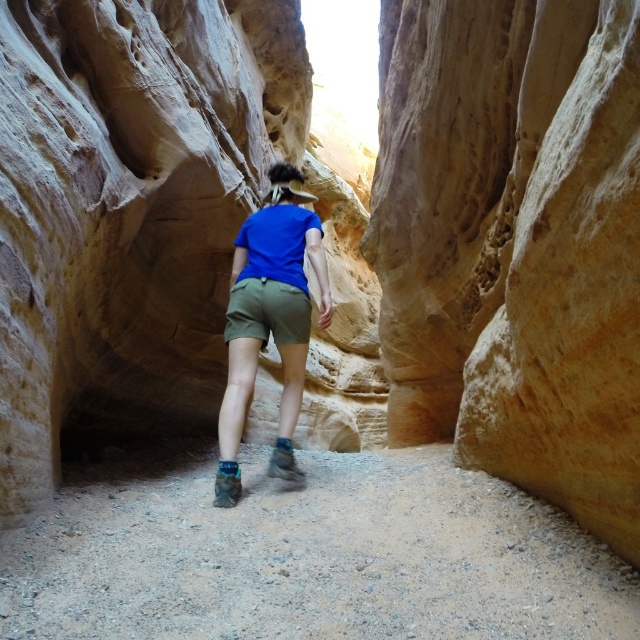
You are a photographer planning to take a portrait of the person in the narrow slot canyon. Since the canyon walls are very close, you need to ensure the person is framed properly. Given the positions of the blue fabric shirt at center and the khaki cotton shorts at center, which clothing item should be positioned closer to the camera to avoid the canyon walls blocking the view?

The blue fabric shirt at center is not as tall as the khaki cotton shorts at center, so positioning the blue fabric shirt at center closer to the camera would help avoid the taller khaki cotton shorts at center being obscured by the canyon walls.

You are a photographer planning to take a portrait of the person in the canyon. Given that the blue fabric shirt at center is below the khaki cotton shorts at center, where should you position your camera to ensure both items are visible in the frame?

Position the camera at a lower angle so that the blue fabric shirt at center and the khaki cotton shorts at center are both visible, as the shirt is positioned below the shorts.

You are the person in the image walking through the narrow slot canyon. You want to step onto the dusty gravel trail at center. Is the trail in front of your khaki cotton shorts at center, making it accessible for you to step onto?

Yes, the dusty gravel trail at center is in front of the khaki cotton shorts at center, so it is accessible for you to step onto.